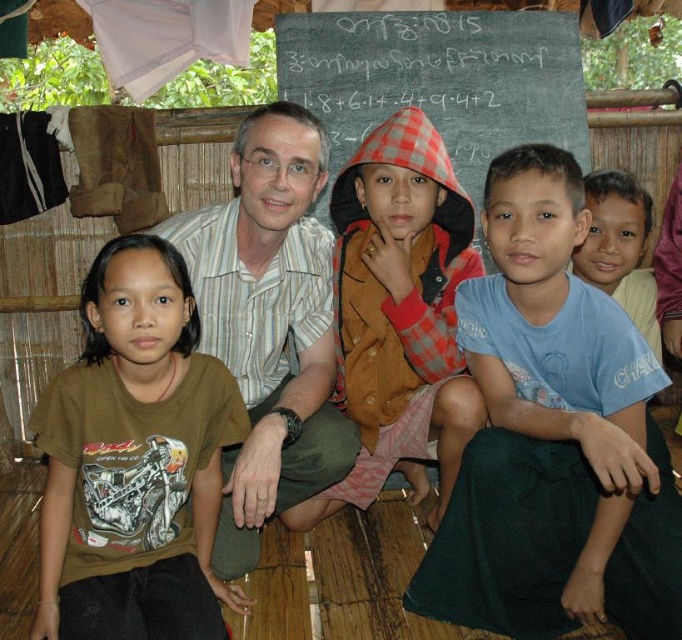
Question: Which point appears farthest from the camera in this image?

Choices:
 (A) (359, 157)
 (B) (445, 88)
 (C) (170, 518)
 (D) (595, 285)

Answer: (B)

Question: Can you confirm if blackboard at upper center is positioned to the right of blue cotton shirt at lower right?

Choices:
 (A) no
 (B) yes

Answer: (A)

Question: Based on their relative distances, which object is farther from the brown textured jacket at center?

Choices:
 (A) blue cotton shirt at center
 (B) brown cotton t-shirt at left
 (C) white striped shirt at center
 (D) blackboard at upper center

Answer: (D)

Question: Can you confirm if blue cotton shirt at center is positioned to the right of brown cotton t-shirt at left?

Choices:
 (A) no
 (B) yes

Answer: (B)

Question: Is blue cotton shirt at center below blue cotton shirt at lower right?

Choices:
 (A) yes
 (B) no

Answer: (A)

Question: Which object is the farthest from the white striped shirt at center?

Choices:
 (A) blackboard at upper center
 (B) brown textured jacket at center
 (C) brown cotton t-shirt at left
 (D) blue cotton shirt at center

Answer: (A)